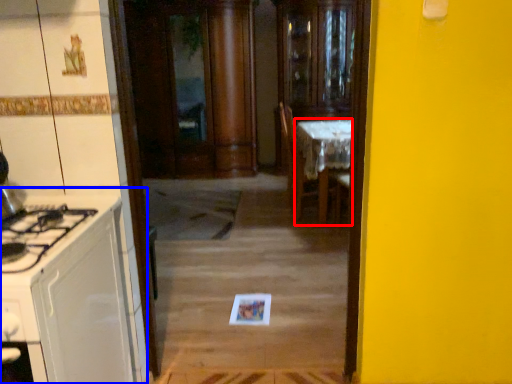
Question: Which object appears closest to the camera in this image, table (highlighted by a red box) or cabinetry (highlighted by a blue box)?

Choices:
 (A) table
 (B) cabinetry

Answer: (B)